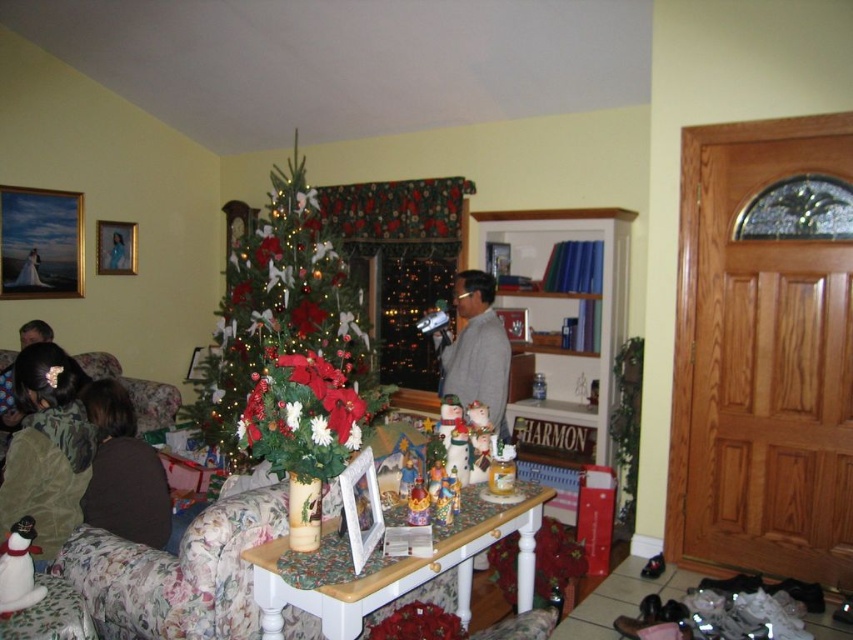
You are a guest at a Christmas party and see the green matte christmas tree at center and the brown fuzzy sweater at left. Which object is closer to you?

The green matte christmas tree at center is closer to you because it is positioned over the brown fuzzy sweater at left, indicating it is in front.

Looking at this image, you are standing in the living room and want to place a new decoration on the green matte christmas tree at center. If the tree is located at coordinates approximately 0.54 in the x and 0.34 in the y direction, where should you walk to reach it?

The green matte christmas tree at center is located at coordinates approximately 0.54 in the x and 0.34 in the y direction, so you should walk towards the center of the room to reach it.

You are standing in the living room and want to move from the sofa to the Christmas tree. There are two points marked on the floor near the sofa and the tree. The first point is at coordinate point (201,420) and the second point is at coordinate point (27,500). Which point is closer to you as you stand at the sofa?

Point (201,420) is further to the camera than point (27,500). Therefore, point (27,500) is closer to you as you stand at the sofa.